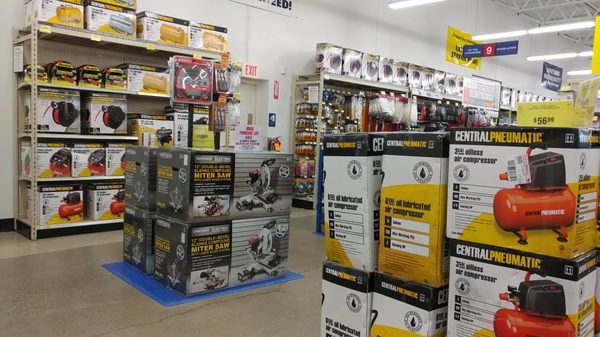
Find the location of a particular element. Image resolution: width=600 pixels, height=337 pixels. yellow poster sign is located at coordinates coord(456,44).